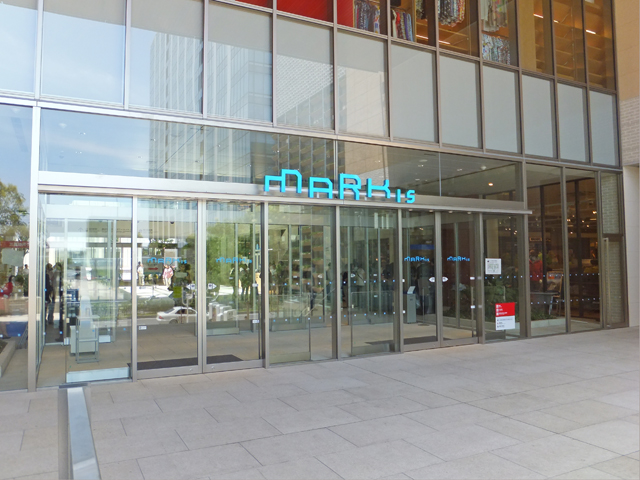
Find the location of a particular element. square tan flooring is located at coordinates 476,414.